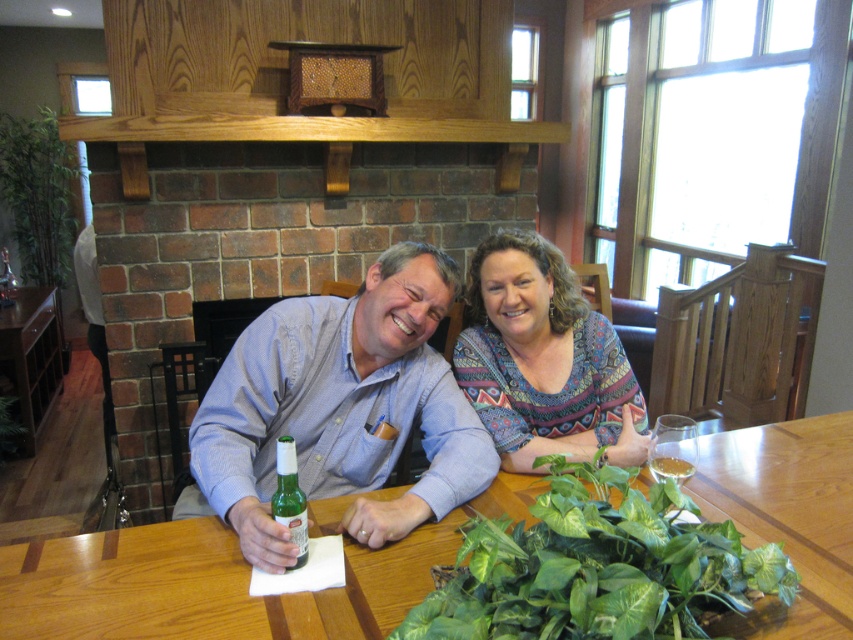
Question: Which point is closer to the camera?

Choices:
 (A) (485, 522)
 (B) (674, 449)

Answer: (A)

Question: Based on their relative distances, which object is farther from the matte blue shirt at center?

Choices:
 (A) wooden table at center
 (B) green glass bottle at center
 (C) multicolored woven sweater at center
 (D) clear glass wine glass at right

Answer: (D)

Question: Is brick fireplace at center wider than green leafy spinach at lower center?

Choices:
 (A) no
 (B) yes

Answer: (B)

Question: Which of the following is the farthest from the observer?

Choices:
 (A) (666, 413)
 (B) (379, 346)
 (C) (476, 545)

Answer: (A)

Question: Can you confirm if green leafy spinach at lower center is positioned below multicolored woven sweater at center?

Choices:
 (A) no
 (B) yes

Answer: (B)

Question: Where is wooden table at center located in relation to green leafy spinach at lower center in the image?

Choices:
 (A) left
 (B) right

Answer: (B)